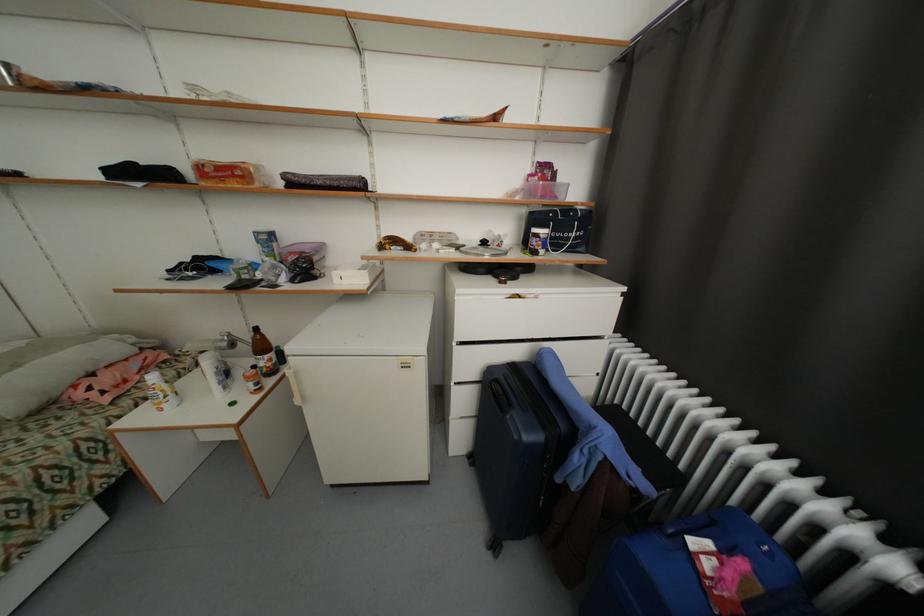
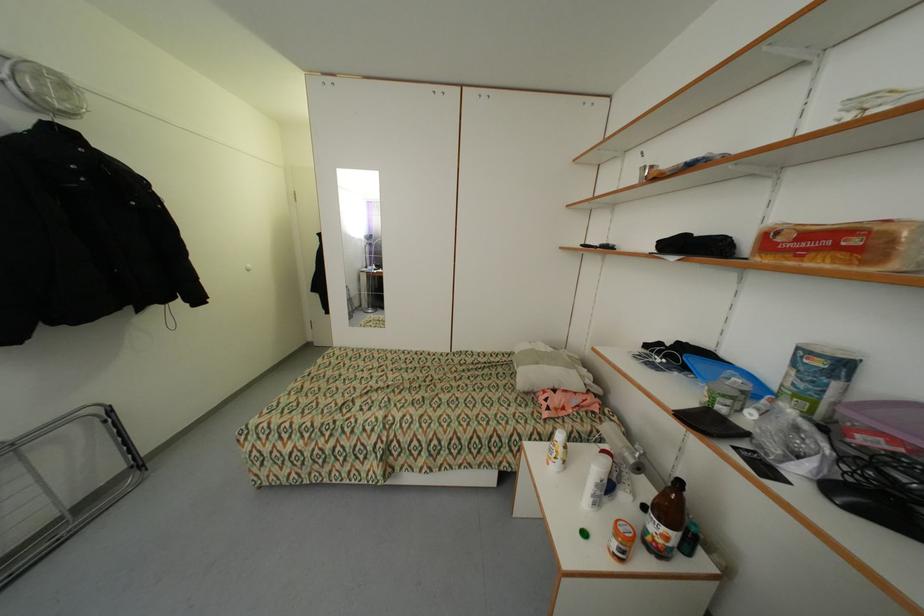
Locate, in the second image, the point that corresponds to pixel 224 376 in the first image.

(603, 487)